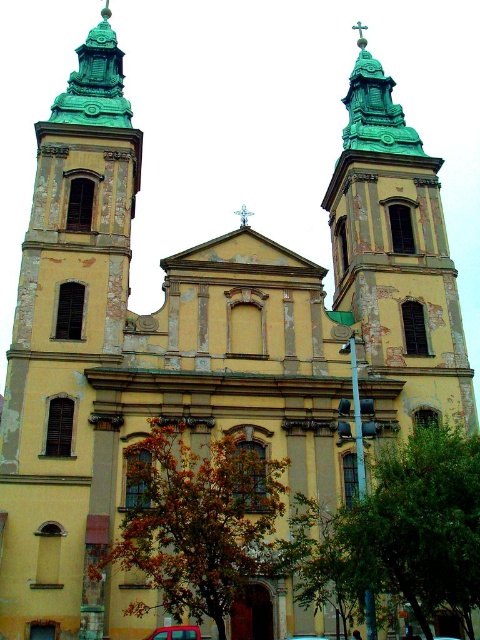
You are a delivery driver who needs to park your van between the metallic red car at lower center and the metallic blue car at center. The van is 6 meters long. Is there enough space between them for your van?

The distance between the metallic red car at lower center and the metallic blue car at center is 7.47 meters. Since the van is 6 meters long, there is enough space between them for the van to park.